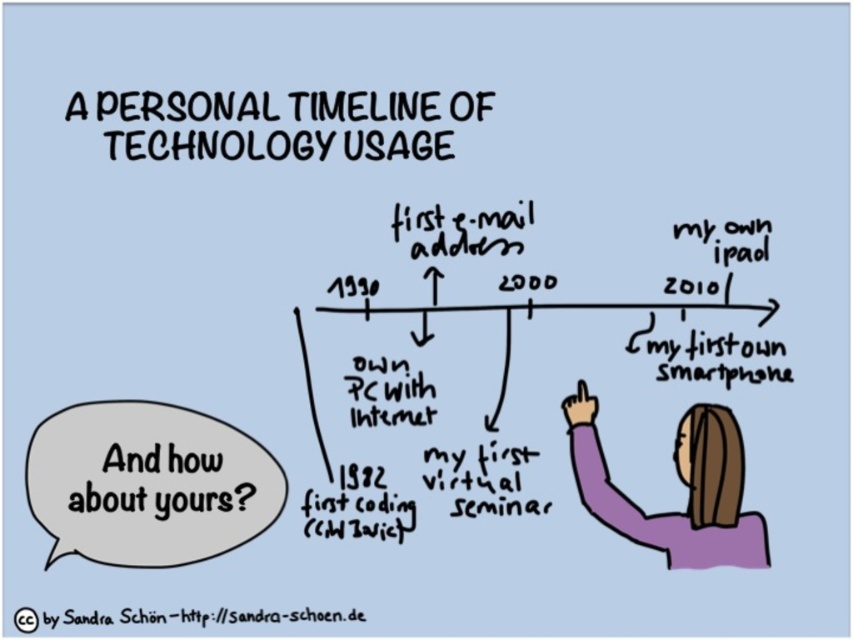
Question: Which point appears closest to the camera in this image?

Choices:
 (A) (206, 458)
 (B) (163, 154)

Answer: (B)

Question: Which of the following is the closest to the observer?

Choices:
 (A) (189, 493)
 (B) (718, 529)

Answer: (A)

Question: Is gray paper speech bubble at lower left positioned behind black paper at upper center?

Choices:
 (A) no
 (B) yes

Answer: (A)

Question: Which point is closer to the camera taking this photo?

Choices:
 (A) (117, 140)
 (B) (91, 502)
 (C) (103, 433)

Answer: (B)

Question: Does black paper speech bubble at lower left appear on the left side of bluetextcc symbol at upper left?

Choices:
 (A) no
 (B) yes

Answer: (B)

Question: Can you confirm if gray paper speech bubble at lower left is thinner than black handwritten text at center?

Choices:
 (A) yes
 (B) no

Answer: (B)